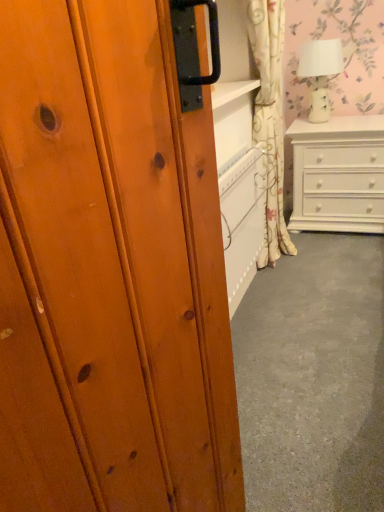
Question: Is floral fabric curtain at upper right turned away from white glossy chest of drawers at right?

Choices:
 (A) yes
 (B) no

Answer: (B)

Question: From a real-world perspective, does floral fabric curtain at upper right sit lower than white glossy chest of drawers at right?

Choices:
 (A) no
 (B) yes

Answer: (A)

Question: From the image's perspective, is floral fabric curtain at upper right below white glossy chest of drawers at right?

Choices:
 (A) yes
 (B) no

Answer: (B)

Question: From the image's perspective, is floral fabric curtain at upper right over white glossy chest of drawers at right?

Choices:
 (A) no
 (B) yes

Answer: (B)

Question: Would you say white glossy chest of drawers at right is part of floral fabric curtain at upper right's contents?

Choices:
 (A) no
 (B) yes

Answer: (A)

Question: Is floral fabric curtain at upper right not close to white glossy chest of drawers at right?

Choices:
 (A) yes
 (B) no

Answer: (B)

Question: From a real-world perspective, is floral fabric curtain at upper right positioned over white ceramic lamp at upper right based on gravity?

Choices:
 (A) yes
 (B) no

Answer: (B)

Question: Can you confirm if floral fabric curtain at upper right is shorter than white ceramic lamp at upper right?

Choices:
 (A) no
 (B) yes

Answer: (A)

Question: Is floral fabric curtain at upper right bigger than white ceramic lamp at upper right?

Choices:
 (A) yes
 (B) no

Answer: (A)

Question: Considering the relative sizes of floral fabric curtain at upper right and white ceramic lamp at upper right in the image provided, is floral fabric curtain at upper right wider than white ceramic lamp at upper right?

Choices:
 (A) yes
 (B) no

Answer: (B)

Question: Is floral fabric curtain at upper right directly adjacent to white ceramic lamp at upper right?

Choices:
 (A) yes
 (B) no

Answer: (B)

Question: From the image's perspective, is floral fabric curtain at upper right located beneath white ceramic lamp at upper right?

Choices:
 (A) no
 (B) yes

Answer: (B)

Question: Can you confirm if white glossy chest of drawers at right is thinner than floral fabric curtain at upper right?

Choices:
 (A) yes
 (B) no

Answer: (B)